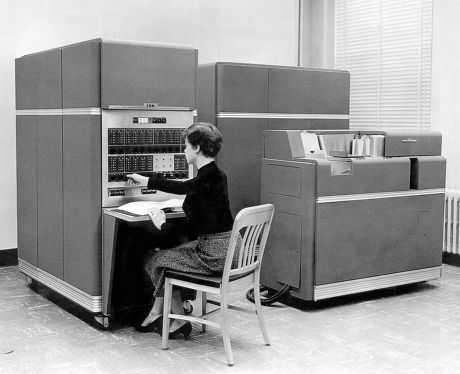
Where is `book`? book is located at coordinates (139, 209).